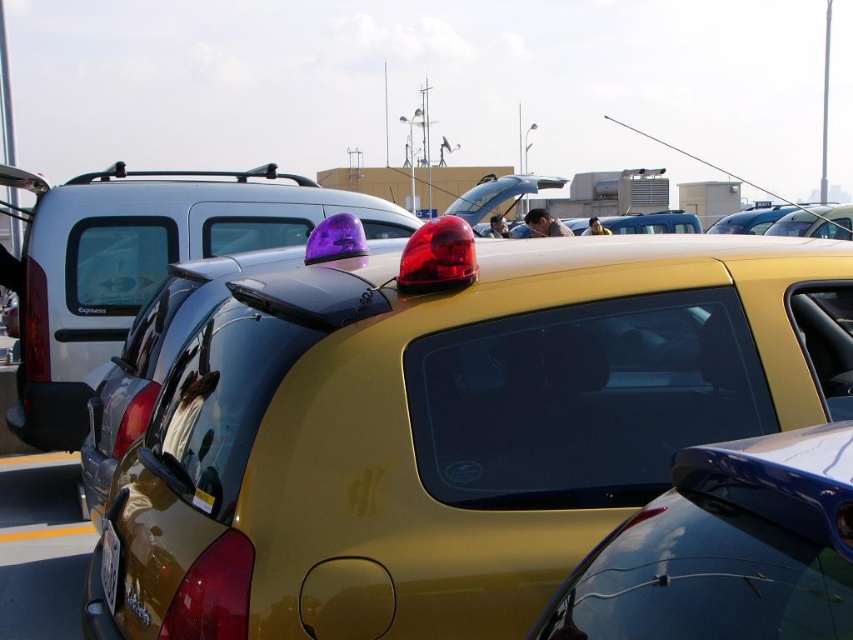
You are a parking attendant trying to verify the license plate of the yellow car. You notice a yellow matte line at lower center and a yellow plastic license plate at lower center. Which object is positioned to the right of the other?

The yellow plastic license plate at lower center is to the right of the yellow matte line at lower center.

You are standing in the parking lot and want to locate the glossy blue spoiler at upper right. Which direction should you look relative to the black glossy line at lower left?

→ The glossy blue spoiler at upper right is above the black glossy line at lower left, so you should look upward from the black glossy line at lower left to find it.